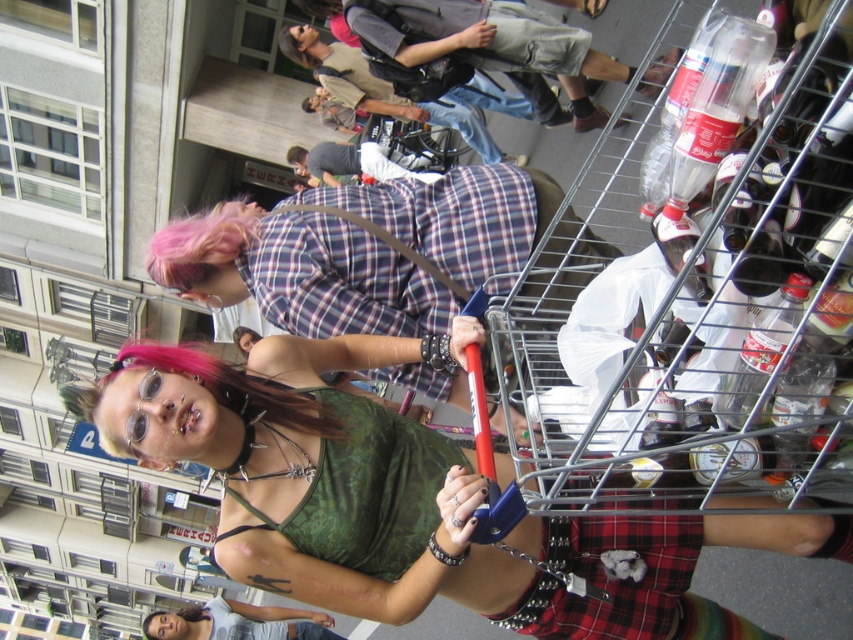
Is clear plastic bottles at center positioned at the back of green fabric tank top at center?

No, it is not.

Is clear plastic bottles at center positioned before green fabric tank top at center?

Yes, clear plastic bottles at center is in front of green fabric tank top at center.

Find the location of a particular element. clear plastic bottles at center is located at coordinates tap(698, 285).

Measure the distance between point (x=811, y=524) and camera.

Point (x=811, y=524) and camera are 4.57 meters apart.

Does point (747, 502) come closer to viewer compared to point (292, 147)?

Yes.

Who is more distant from viewer, (802, 522) or (357, 170)?

Point (357, 170)

The height and width of the screenshot is (640, 853). I want to click on green fabric tank top at center, so [396, 497].

Is clear plastic bottles at center bigger than plaid shirt at center?

No.

Is clear plastic bottles at center taller than plaid shirt at center?

Yes, clear plastic bottles at center is taller than plaid shirt at center.

Between point (776, 216) and point (320, 177), which one is positioned behind?

Positioned behind is point (320, 177).

The image size is (853, 640). I want to click on clear plastic bottles at center, so click(698, 285).